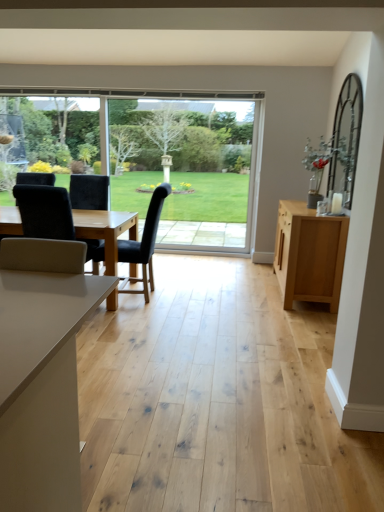
Question: Can you confirm if velvet black chair at left, the second chair in the right-to-left sequence, is wider than clear glass window at center?

Choices:
 (A) yes
 (B) no

Answer: (A)

Question: Can you confirm if velvet black chair at left, which appears as the 1th chair when viewed from the left, is taller than clear glass window at center?

Choices:
 (A) no
 (B) yes

Answer: (A)

Question: Is velvet black chair at left, which appears as the 1th chair when viewed from the left, oriented away from clear glass window at center?

Choices:
 (A) yes
 (B) no

Answer: (B)

Question: From the image's perspective, is velvet black chair at left, which appears as the 1th chair when viewed from the left, located above clear glass window at center?

Choices:
 (A) no
 (B) yes

Answer: (A)

Question: Can you see velvet black chair at left, which appears as the 1th chair when viewed from the left, touching clear glass window at center?

Choices:
 (A) yes
 (B) no

Answer: (B)

Question: Considering the positions of black fabric chair at center, arranged as the 2th chair when viewed from the left, and clear glass window at center in the image, is black fabric chair at center, arranged as the 2th chair when viewed from the left, wider or thinner than clear glass window at center?

Choices:
 (A) wide
 (B) thin

Answer: (A)

Question: In terms of size, does black fabric chair at center, arranged as the 2th chair when viewed from the left, appear bigger or smaller than clear glass window at center?

Choices:
 (A) small
 (B) big

Answer: (B)

Question: From a real-world perspective, is black fabric chair at center, the 1th chair when ordered from right to left, positioned above or below clear glass window at center?

Choices:
 (A) below
 (B) above

Answer: (A)

Question: Is black fabric chair at center, arranged as the 2th chair when viewed from the left, inside or outside of clear glass window at center?

Choices:
 (A) inside
 (B) outside

Answer: (B)

Question: From a real-world perspective, is black fabric chair at center, the 1th chair when ordered from right to left, above or below light wood cabinet at right?

Choices:
 (A) above
 (B) below

Answer: (A)

Question: Looking at the image, does black fabric chair at center, the 1th chair when ordered from right to left, seem bigger or smaller compared to light wood cabinet at right?

Choices:
 (A) big
 (B) small

Answer: (B)

Question: In the image, is black fabric chair at center, the 1th chair when ordered from right to left, positioned in front of or behind light wood cabinet at right?

Choices:
 (A) behind
 (B) front

Answer: (A)

Question: Is point (142, 256) positioned closer to the camera than point (281, 234)?

Choices:
 (A) closer
 (B) farther

Answer: (A)

Question: From a real-world perspective, is black fabric chair at center, the 1th chair when ordered from right to left, physically located above or below velvet black chair at left, the second chair in the right-to-left sequence?

Choices:
 (A) above
 (B) below

Answer: (B)

Question: Considering the positions of point (155, 203) and point (61, 226), is point (155, 203) closer or farther from the camera than point (61, 226)?

Choices:
 (A) closer
 (B) farther

Answer: (B)